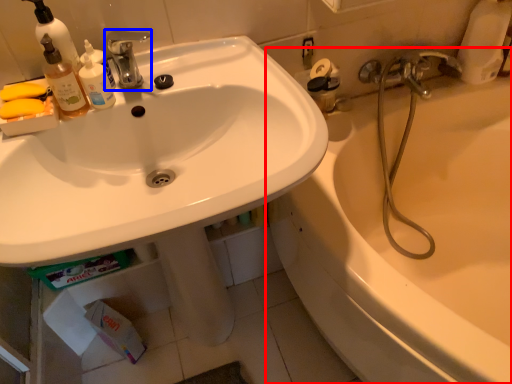
Question: Which object appears farthest to the camera in this image, bathtub (highlighted by a red box) or tap (highlighted by a blue box)?

Choices:
 (A) bathtub
 (B) tap

Answer: (B)